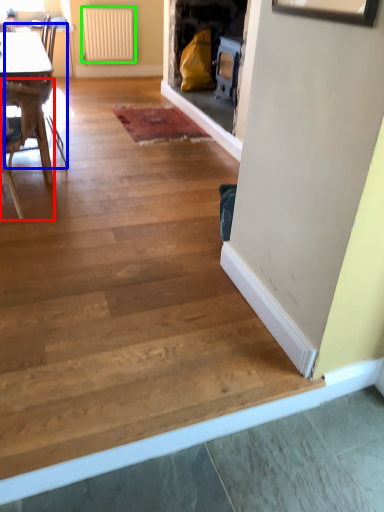
Question: Estimate the real-world distances between objects in this image. Which object is closer to chair (highlighted by a red box), armchair (highlighted by a blue box) or radiator (highlighted by a green box)?

Choices:
 (A) armchair
 (B) radiator

Answer: (A)